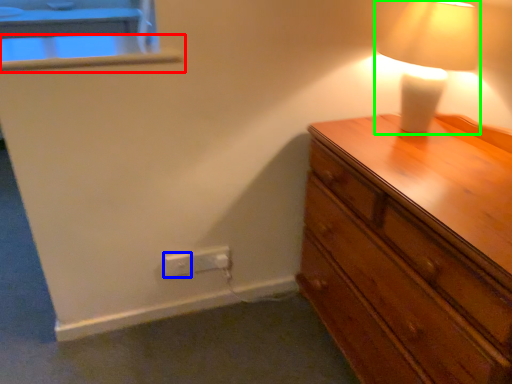
Question: Which object is positioned farthest from window sill (highlighted by a red box)? Select from electric outlet (highlighted by a blue box) and lamp (highlighted by a green box).

Choices:
 (A) electric outlet
 (B) lamp

Answer: (B)